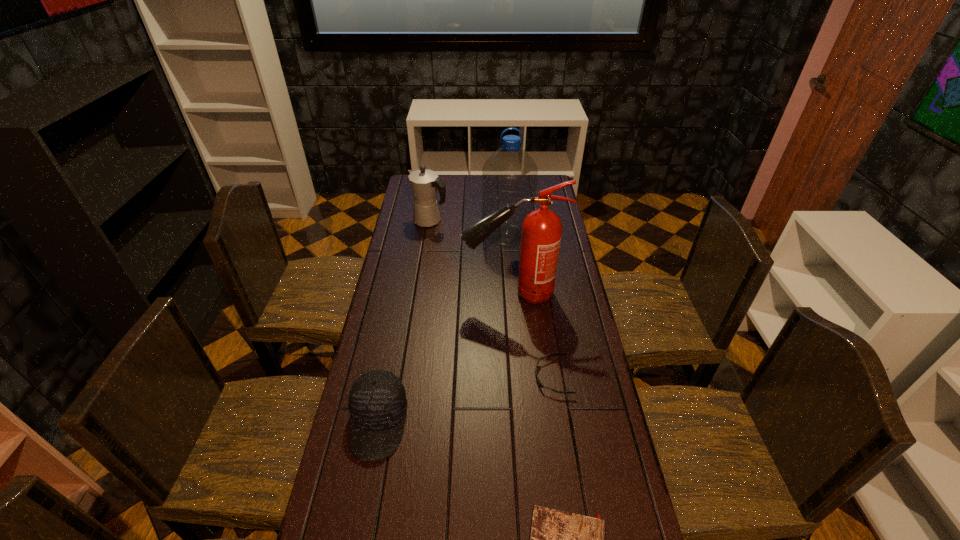
Where is `the fourth closest object to the nearest object`? This screenshot has width=960, height=540. the fourth closest object to the nearest object is located at coordinates (509, 175).

You are a GUI agent. You are given a task and a screenshot of the screen. Output one action in this format:
    pyautogui.click(x=<x>, y=<y>)
    Task: Click on the object that can be found as the closest to the water jug
    
    Given the screenshot: What is the action you would take?
    pyautogui.click(x=424, y=182)

At what (x,y) coordinates should I click in order to perform the action: click on vacant space that satisfies the following two spatial constraints: 1. on the front-facing side of the sunglasses; 2. at the front of the baseball cap where the brim is located. Please return your answer as a coordinate pair (x, y). Looking at the image, I should click on (560, 423).